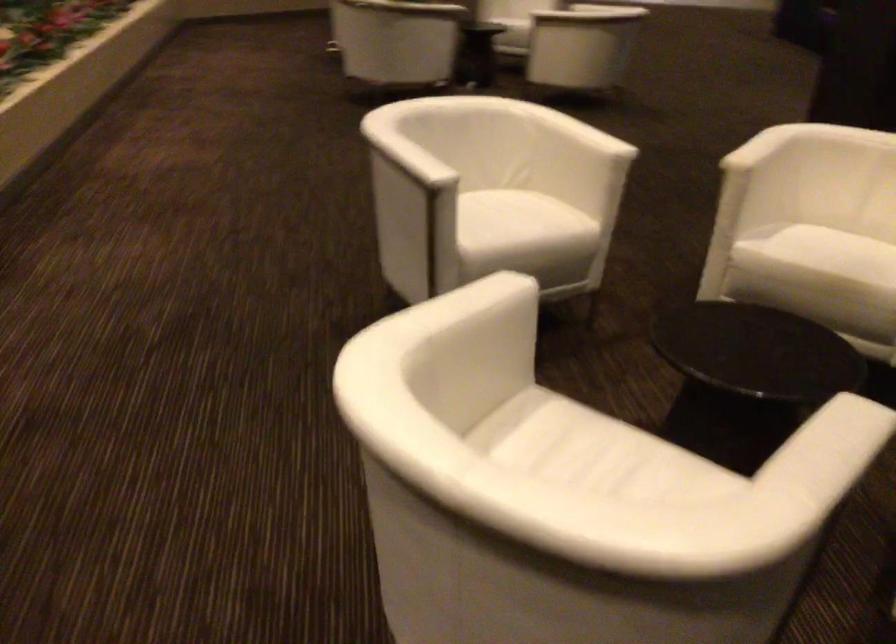
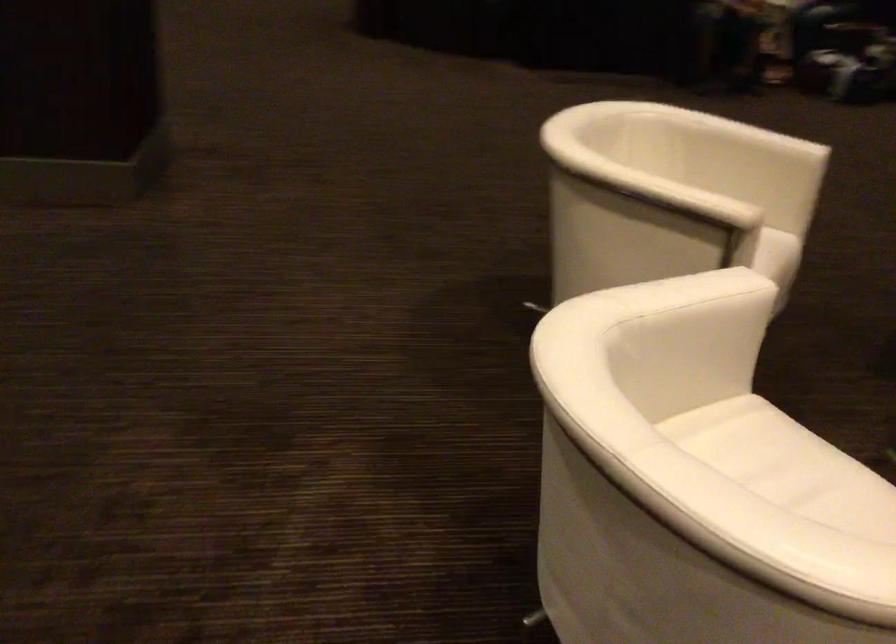
Locate, in the second image, the point that corresponds to point 531,207 in the first image.

(767, 453)